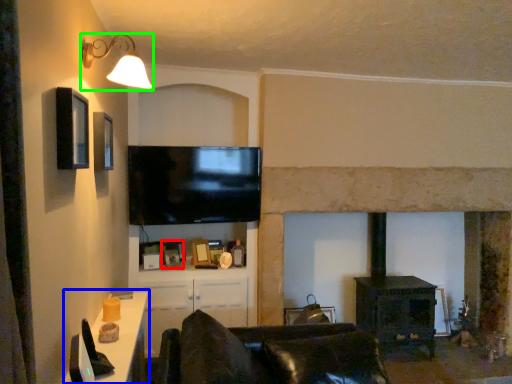
Question: Estimate the real-world distances between objects in this image. Which object is closer to picture frame (highlighted by a red box), table (highlighted by a blue box) or light fixture (highlighted by a green box)?

Choices:
 (A) table
 (B) light fixture

Answer: (A)